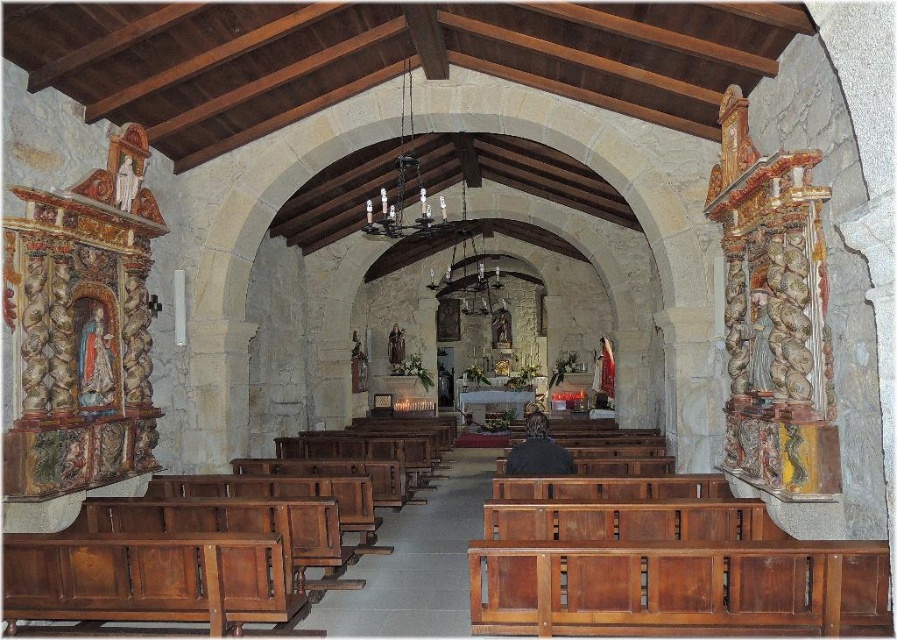
Question: Considering the real-world distances, which object is closest to the matte white statue at left?

Choices:
 (A) wooden polished bench at lower center
 (B) matte painted statue at left

Answer: (B)

Question: Is matte painted statue at left smaller than matte white statue at left?

Choices:
 (A) no
 (B) yes

Answer: (A)

Question: Is matte painted statue at left positioned behind matte white statue at left?

Choices:
 (A) yes
 (B) no

Answer: (B)

Question: Observing the image, what is the correct spatial positioning of dark brown leather jacket at center in reference to matte white statue at left?

Choices:
 (A) right
 (B) left

Answer: (A)

Question: Which object is farther from the camera taking this photo?

Choices:
 (A) matte painted statue at left
 (B) wooden polished bench at lower center
 (C) dark brown leather jacket at center
 (D) matte white statue at left

Answer: (D)

Question: Which of the following is the farthest from the observer?

Choices:
 (A) (127, 184)
 (B) (525, 461)
 (C) (666, 547)

Answer: (A)